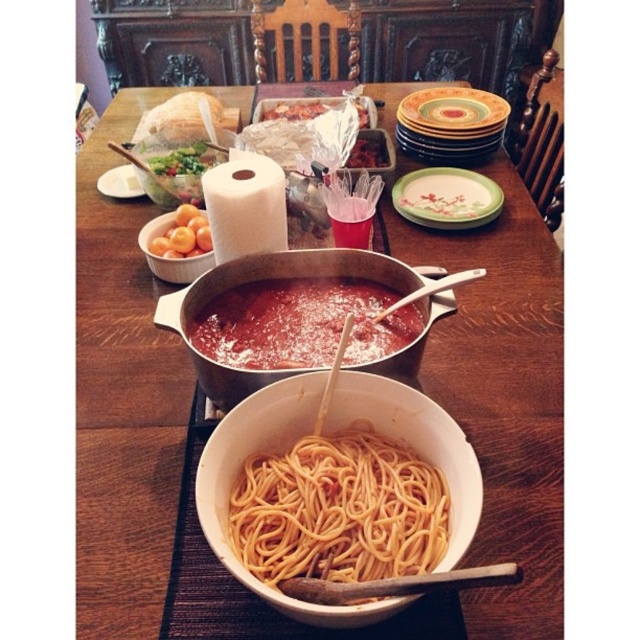
Question: From the image, what is the correct spatial relationship of white paper towel at center in relation to multicolored ceramic plate at center?

Choices:
 (A) left
 (B) right

Answer: (A)

Question: Which is farther from the green matte plate at center?

Choices:
 (A) white ceramic bowl at center
 (B) smooth white bread at upper center
 (C) matte ceramic pot at center

Answer: (C)

Question: Is white paper towel at center bigger than multicolored ceramic plate at center?

Choices:
 (A) no
 (B) yes

Answer: (A)

Question: Is white ceramic bowl at center behind orange matte/orange matte/orange at upper left?

Choices:
 (A) yes
 (B) no

Answer: (B)

Question: Which object is farther from the camera taking this photo?

Choices:
 (A) white matte bowl at center
 (B) smooth tomato sauce at center
 (C) white ceramic bowl at center
 (D) multicolored ceramic plate at center

Answer: (D)

Question: Among these points, which one is nearest to the camera?

Choices:
 (A) (484, 97)
 (B) (278, 234)
 (C) (515, 276)
 (D) (320, 342)

Answer: (D)